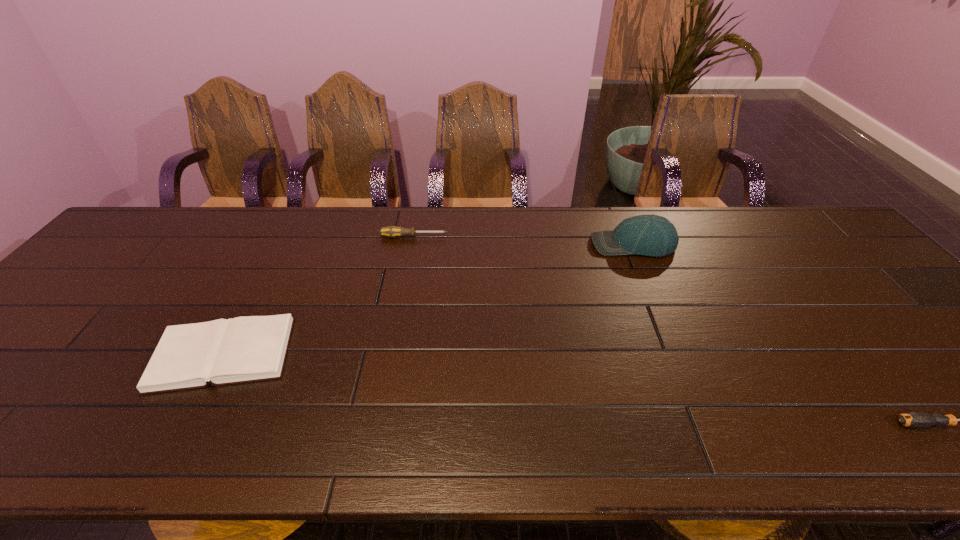
Where is `unoccupied area between the left screwdriver and the second object from right to left`? unoccupied area between the left screwdriver and the second object from right to left is located at coordinates (x=523, y=241).

Locate an element on the screen. The width and height of the screenshot is (960, 540). unoccupied position between the third farthest object and the baseball cap is located at coordinates (428, 299).

Where is `the second closest object to the rightmost object`? Image resolution: width=960 pixels, height=540 pixels. the second closest object to the rightmost object is located at coordinates (391, 231).

Point out which object is positioned as the third nearest to the second object from left to right. Please provide its 2D coordinates. Your answer should be formatted as a tuple, i.e. [(x, y)], where the tuple contains the x and y coordinates of a point satisfying the conditions above.

[(913, 419)]

Image resolution: width=960 pixels, height=540 pixels. What are the coordinates of `vacant space that satisfies the following two spatial constraints: 1. at the tip of the taller screwdriver; 2. on the left side of the baseball cap` in the screenshot? It's located at (413, 245).